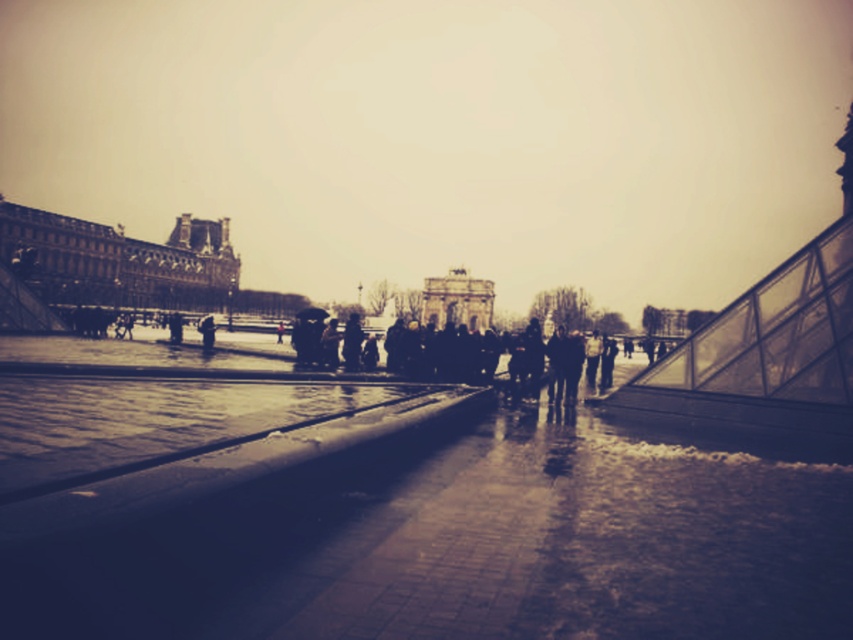
Question: Which of the following is the farthest from the observer?

Choices:
 (A) (33, 224)
 (B) (461, 307)
 (C) (422, 349)

Answer: (B)

Question: Is dark brown stone palace at left bigger than dark gray fabric coat at center?

Choices:
 (A) no
 (B) yes

Answer: (B)

Question: Does dark gray fabric coat at center appear under stone archway at center?

Choices:
 (A) no
 (B) yes

Answer: (B)

Question: Which of the following is the farthest from the observer?

Choices:
 (A) (10, 250)
 (B) (563, 344)
 (C) (489, 305)

Answer: (C)

Question: Does dark brown stone palace at left appear on the right side of dark gray fabric coat at center?

Choices:
 (A) no
 (B) yes

Answer: (A)

Question: Which of the following is the closest to the observer?

Choices:
 (A) (608, 380)
 (B) (0, 250)
 (C) (469, 282)

Answer: (A)